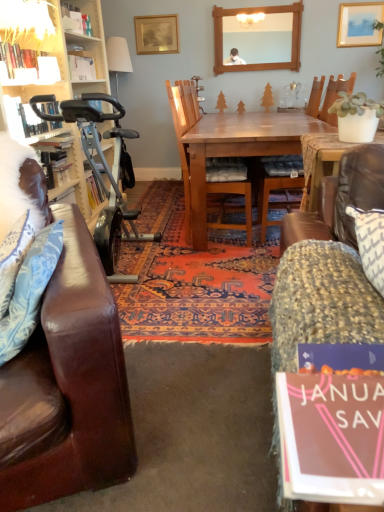
This screenshot has width=384, height=512. Describe the element at coordinates (268, 200) in the screenshot. I see `wooden chair at center, the second chair positioned from the left` at that location.

Image resolution: width=384 pixels, height=512 pixels. What do you see at coordinates (328, 266) in the screenshot? I see `fluffy fabric couch at lower right` at bounding box center [328, 266].

Identify the location of wooden table at center. The width and height of the screenshot is (384, 512). (236, 151).

The width and height of the screenshot is (384, 512). I want to click on matte white lampshade at upper left, so 27,24.

Identify the location of blue floral fabric pillow at left. (30, 291).

Locate an element on the screen. This screenshot has width=384, height=512. wooden frame mirror at upper center is located at coordinates (259, 39).

Find the location of a particular element. This screenshot has width=384, height=512. wooden chair at center, arranged as the 1th chair when viewed from the right is located at coordinates (268, 200).

From the image's perspective, is silver metallic exercise bike at left positioned above or below wooden chair at center, the second chair from the right?

Clearly, from the image's perspective, silver metallic exercise bike at left is below wooden chair at center, the second chair from the right.

From the picture: Considering the sizes of objects silver metallic exercise bike at left and wooden chair at center, the 1th chair when ordered from left to right, in the image provided, who is smaller, silver metallic exercise bike at left or wooden chair at center, the 1th chair when ordered from left to right,?

wooden chair at center, the 1th chair when ordered from left to right.

Can you confirm if silver metallic exercise bike at left is thinner than wooden chair at center, the 1th chair when ordered from left to right?

Yes.

Does silver metallic exercise bike at left have a lesser height compared to wooden chair at center, the second chair from the right?

Indeed, silver metallic exercise bike at left has a lesser height compared to wooden chair at center, the second chair from the right.

From a real-world perspective, which object stands above the other?

wooden chair at center, arranged as the 1th chair when viewed from the right, from a real-world perspective.

Can you see wooden table at center touching wooden chair at center, the second chair positioned from the left?

There is a gap between wooden table at center and wooden chair at center, the second chair positioned from the left.

Considering the positions of objects wooden table at center and wooden chair at center, the second chair positioned from the left, in the image provided, who is in front, wooden table at center or wooden chair at center, the second chair positioned from the left,?

wooden table at center is closer to the camera.

Can you confirm if wooden table at center is smaller than wooden chair at center, the second chair positioned from the left?

Actually, wooden table at center might be larger than wooden chair at center, the second chair positioned from the left.

Is matte white lampshade at upper left next to wooden table at center and touching it?

matte white lampshade at upper left is not next to wooden table at center, and they're not touching.

Considering the relative positions of matte white lampshade at upper left and wooden table at center in the image provided, is matte white lampshade at upper left to the left of wooden table at center from the viewer's perspective?

Yes.

Is wooden table at center completely or partially inside matte white lampshade at upper left?

That's incorrect, wooden table at center is not inside matte white lampshade at upper left.

From the picture: How different are the orientations of fluffy fabric couch at lower right and matte gold picture frame at upper right, arranged as the second picture frame when viewed from the back, in degrees?

The angular difference between fluffy fabric couch at lower right and matte gold picture frame at upper right, arranged as the second picture frame when viewed from the back, is 3.69 degrees.

Is fluffy fabric couch at lower right taller or shorter than matte gold picture frame at upper right, which is the second picture frame in left-to-right order?

Clearly, fluffy fabric couch at lower right is taller compared to matte gold picture frame at upper right, which is the second picture frame in left-to-right order.

Is matte gold picture frame at upper right, which is the second picture frame in left-to-right order, at the back of fluffy fabric couch at lower right?

Yes, fluffy fabric couch at lower right is positioned with its back facing matte gold picture frame at upper right, which is the second picture frame in left-to-right order.

Between point (352, 160) and point (373, 11), which one is positioned behind?

The point (373, 11) is farther.

Considering the sizes of objects silver metallic exercise bike at left and blue floral fabric pillow at left in the image provided, who is shorter, silver metallic exercise bike at left or blue floral fabric pillow at left?

blue floral fabric pillow at left is shorter.

Would you say blue floral fabric pillow at left is part of silver metallic exercise bike at left's contents?

That's incorrect, blue floral fabric pillow at left is not inside silver metallic exercise bike at left.

Is silver metallic exercise bike at left facing towards blue floral fabric pillow at left?

No, silver metallic exercise bike at left is not turned towards blue floral fabric pillow at left.

Is silver metallic exercise bike at left positioned far away from blue floral fabric pillow at left?

Yes.

Locate an element on the screen. Image resolution: width=384 pixels, height=512 pixels. picture frame that is the 1st one above the fluffy fabric couch at lower right (from a real-world perspective) is located at coordinates (359, 24).

How distant is matte gold picture frame at upper right, which is the first picture frame in right-to-left order, from fluffy fabric couch at lower right?

matte gold picture frame at upper right, which is the first picture frame in right-to-left order, is 4.19 meters away from fluffy fabric couch at lower right.

Is matte gold picture frame at upper right, arranged as the second picture frame when viewed from the back, outside of fluffy fabric couch at lower right?

Indeed, matte gold picture frame at upper right, arranged as the second picture frame when viewed from the back, is completely outside fluffy fabric couch at lower right.

Which of these two, matte gold picture frame at upper right, arranged as the second picture frame when viewed from the back, or fluffy fabric couch at lower right, is smaller?

With smaller size is matte gold picture frame at upper right, arranged as the second picture frame when viewed from the back.

From the image's perspective, is matte white lampshade at upper left located above fluffy fabric couch at lower right?

Yes.

Considering the sizes of objects matte white lampshade at upper left and fluffy fabric couch at lower right in the image provided, who is thinner, matte white lampshade at upper left or fluffy fabric couch at lower right?

matte white lampshade at upper left.

Does matte white lampshade at upper left have a smaller size compared to fluffy fabric couch at lower right?

Yes.

Choose the correct answer: Is matte white lampshade at upper left inside fluffy fabric couch at lower right or outside it?

matte white lampshade at upper left cannot be found inside fluffy fabric couch at lower right.

Which chair is the 1st one when counting from the back of the silver metallic exercise bike at left? Please provide its 2D coordinates.

[(184, 134)]

I want to click on desk in front of the wooden chair at center, arranged as the 1th chair when viewed from the right, so click(236, 151).

Based on the photo, looking at the image, which one is located further to wooden frame mirror at upper center, wooden picture frame at upper center, placed as the second picture frame when sorted from right to left, or fluffy fabric couch at lower right?

Based on the image, fluffy fabric couch at lower right appears to be further to wooden frame mirror at upper center.

Consider the image. When comparing their distances from wooden frame mirror at upper center, does fluffy fabric couch at lower right or wooden chair at center, arranged as the 1th chair when viewed from the right, seem closer?

wooden chair at center, arranged as the 1th chair when viewed from the right, is closer to wooden frame mirror at upper center.

From the image, which object appears to be nearer to fluffy fabric couch at lower right, matte white lampshade at upper left or silver metallic exercise bike at left?

Among the two, silver metallic exercise bike at left is located nearer to fluffy fabric couch at lower right.

Considering their positions, is wooden picture frame at upper center, marked as the second picture frame in a front-to-back arrangement, positioned closer to wooden chair at center, the second chair positioned from the left, than blue floral fabric pillow at left?

blue floral fabric pillow at left lies closer to wooden chair at center, the second chair positioned from the left, than the other object.

Estimate the real-world distances between objects in this image. Which object is closer to wooden picture frame at upper center, acting as the first picture frame starting from the back, fluffy fabric couch at lower right or wooden chair at center, the second chair positioned from the left?

wooden chair at center, the second chair positioned from the left.

Looking at the image, which one is located closer to fluffy fabric couch at lower right, silver metallic exercise bike at left or wooden chair at center, the second chair positioned from the left?

silver metallic exercise bike at left lies closer to fluffy fabric couch at lower right than the other object.

From the image, which object appears to be farther from silver metallic exercise bike at left, wooden picture frame at upper center, acting as the first picture frame starting from the back, or fluffy fabric couch at lower right?

The object further to silver metallic exercise bike at left is fluffy fabric couch at lower right.

Considering their positions, is wooden frame mirror at upper center positioned closer to wooden picture frame at upper center, marked as the second picture frame in a front-to-back arrangement, than blue floral fabric pillow at left?

wooden frame mirror at upper center is positioned closer to the anchor wooden picture frame at upper center, marked as the second picture frame in a front-to-back arrangement.

Identify the location of mirror between wooden chair at center, the second chair positioned from the left, and wooden picture frame at upper center, placed as the second picture frame when sorted from right to left, from front to back. (259, 39).

The width and height of the screenshot is (384, 512). Identify the location of chair situated between matte white lampshade at upper left and wooden table at center from left to right. (184, 134).

Find the location of a particular element. The width and height of the screenshot is (384, 512). mobility scooter located between fluffy fabric couch at lower right and wooden chair at center, the second chair from the right, in the depth direction is located at coordinates (105, 172).

Find the location of a particular element. The width and height of the screenshot is (384, 512). lamp between blue floral fabric pillow at left and wooden frame mirror at upper center in the front-back direction is located at coordinates (27, 24).